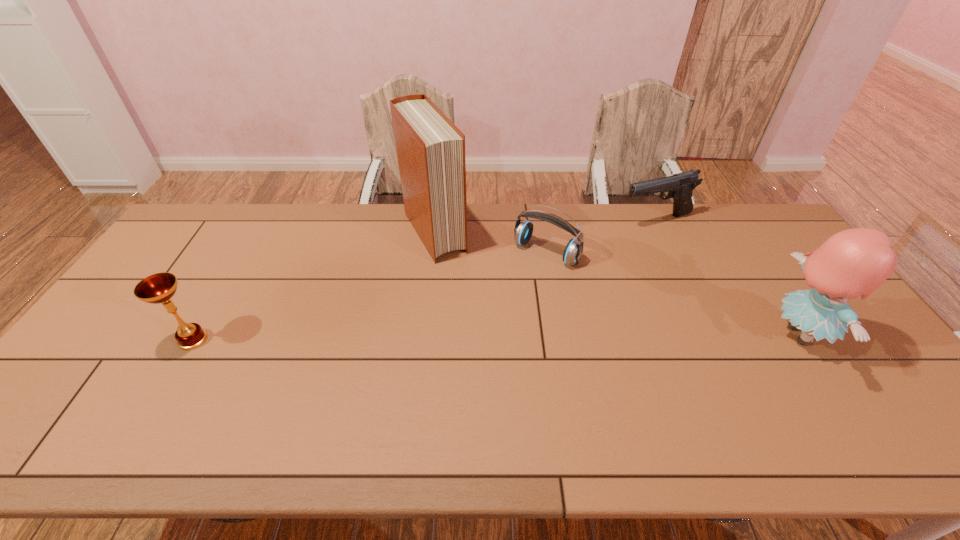
The width and height of the screenshot is (960, 540). In order to click on vacant space situated on the ear cups of the headset in this screenshot , I will do (x=469, y=340).

The image size is (960, 540). What are the coordinates of `free space located on the ear cups of the headset` in the screenshot? It's located at (464, 347).

At what (x,y) coordinates should I click in order to perform the action: click on free space located at the muzzle of the second object from right to left. Please return your answer as a coordinate pair (x, y). The image size is (960, 540). Looking at the image, I should click on (620, 256).

You are a GUI agent. You are given a task and a screenshot of the screen. Output one action in this format:
    pyautogui.click(x=<x>, y=<y>)
    Task: Click on the vacant space positioned 0.270m at the muzzle of the second object from right to left
    The image size is (960, 540).
    Given the screenshot: What is the action you would take?
    pyautogui.click(x=608, y=274)

Locate an element on the screen. Image resolution: width=960 pixels, height=540 pixels. vacant space situated at the muzzle of the second object from right to left is located at coordinates (612, 267).

Find the location of a particular element. Image resolution: width=960 pixels, height=540 pixels. vacant space situated on the open cover of the tallest object is located at coordinates (481, 314).

In order to click on vacant space located 0.380m on the open cover of the tallest object in this screenshot , I will do `click(502, 347)`.

The height and width of the screenshot is (540, 960). In order to click on vacant area situated on the open cover of the tallest object in this screenshot , I will do `click(453, 271)`.

Find the location of a particular element. This screenshot has width=960, height=540. headset positioned at the far edge is located at coordinates (523, 231).

Find the location of a particular element. This screenshot has width=960, height=540. gun that is at the far edge is located at coordinates (680, 186).